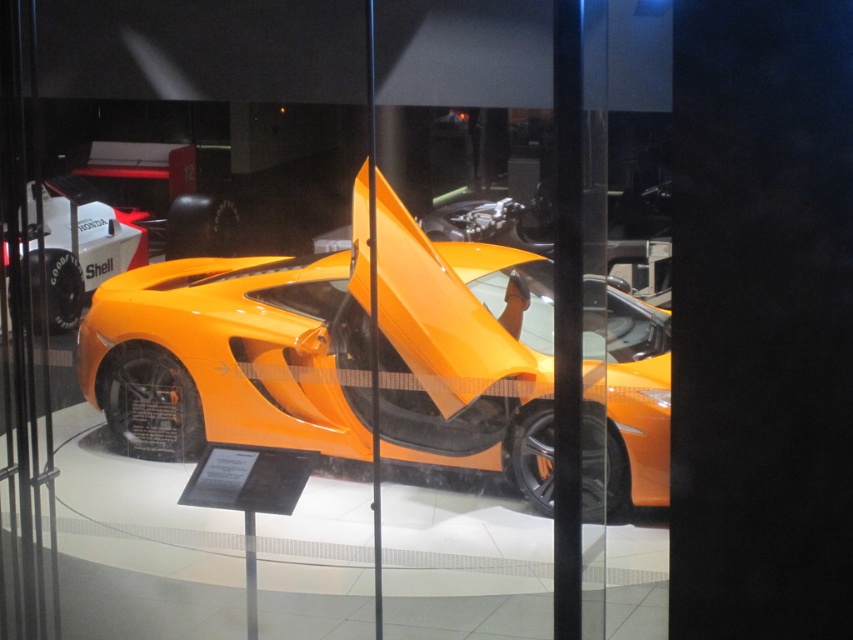
Question: Which object is closer to the camera taking this photo?

Choices:
 (A) orange matte concept car at left
 (B) orange matte sports car at center

Answer: (B)

Question: Which point is closer to the camera taking this photo?

Choices:
 (A) (625, 412)
 (B) (33, 307)

Answer: (A)

Question: Can you confirm if orange matte sports car at center is positioned below orange matte concept car at left?

Choices:
 (A) no
 (B) yes

Answer: (B)

Question: Is orange matte sports car at center behind orange matte concept car at left?

Choices:
 (A) yes
 (B) no

Answer: (B)

Question: Can you confirm if orange matte sports car at center is bigger than orange matte concept car at left?

Choices:
 (A) no
 (B) yes

Answer: (B)

Question: Which point is closer to the camera?

Choices:
 (A) orange matte sports car at center
 (B) orange matte concept car at left

Answer: (A)